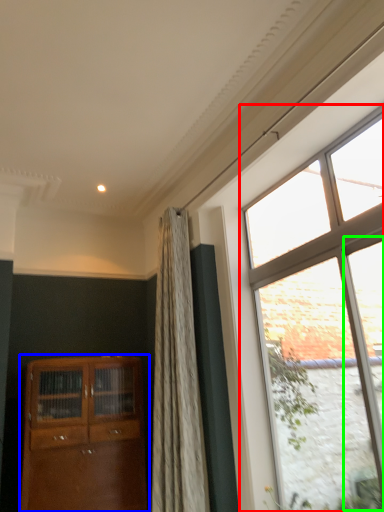
Question: Which object is positioned closest to window (highlighted by a red box)? Select from cabinetry (highlighted by a blue box) and glass door (highlighted by a green box).

Choices:
 (A) cabinetry
 (B) glass door

Answer: (B)